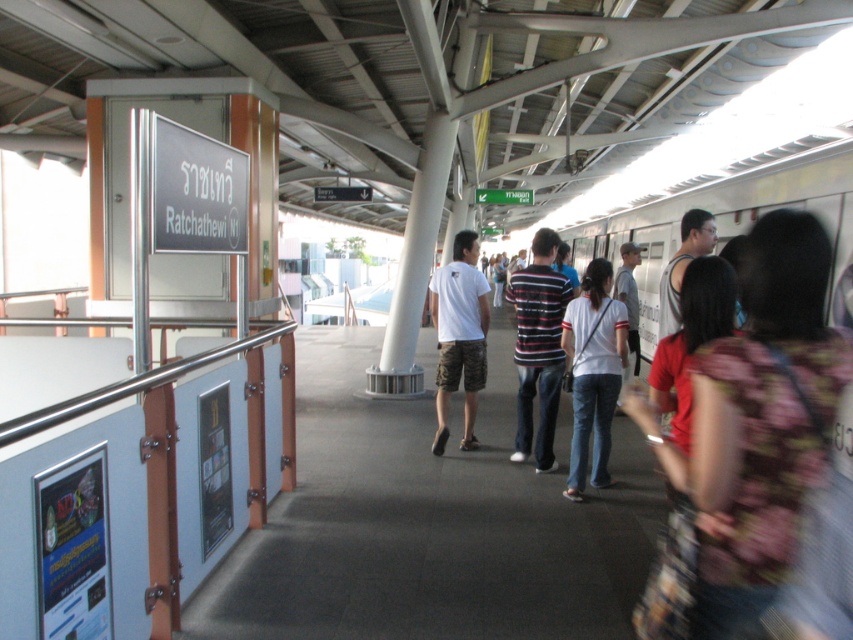
In the scene shown: You are a traveler at the Ratchathewi station platform. You see a floral fabric dress at center and a white cotton shirt at center. Which clothing item is wider?

The floral fabric dress at center is wider than the white cotton shirt at center.

Based on the scene description, where is the white cotton shirt at center located in relation to the ticket vending machine with a digital display?

The white cotton shirt at center is located at point (x=593, y=372), but the exact spatial relation to the ticket vending machine with a digital display cannot be determined without additional information about the ticket vending machine position.